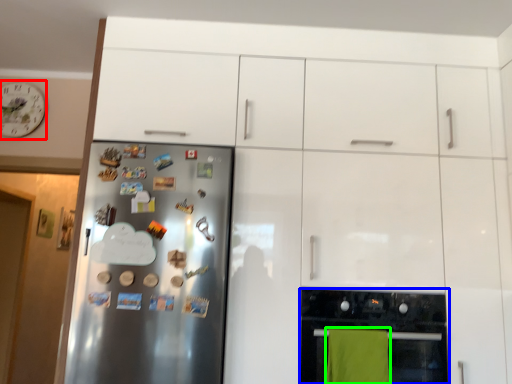
Question: Considering the real-world distances, which object is farthest from clock (highlighted by a red box)? home appliance (highlighted by a blue box) or beach towel (highlighted by a green box)?

Choices:
 (A) home appliance
 (B) beach towel

Answer: (B)